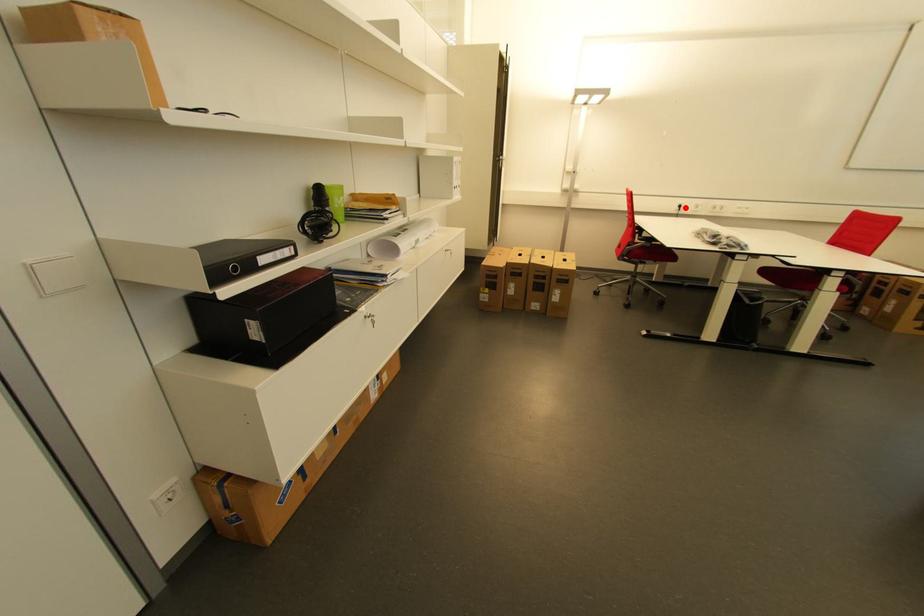
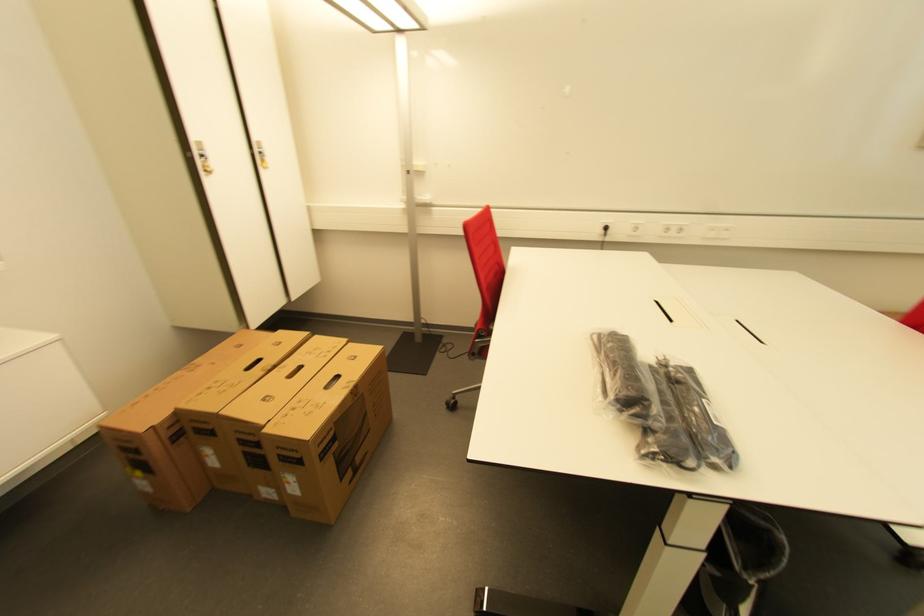
Find the pixel in the second image that matches the highlighted location in the first image.

(611, 230)